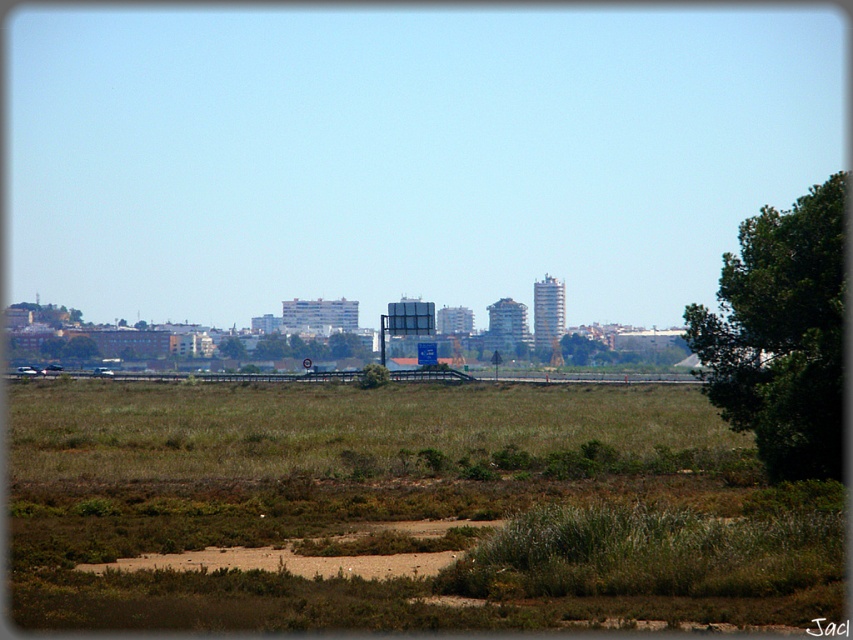
Can you confirm if green leafy tree at right is smaller than green leafy tree at center?

Correct, green leafy tree at right occupies less space than green leafy tree at center.

Which is in front, point (759, 339) or point (285, 348)?

Point (759, 339) is in front.

Who is more distant from viewer, (758, 227) or (239, 355)?

Positioned behind is point (239, 355).

The width and height of the screenshot is (853, 640). Find the location of `green leafy tree at right`. green leafy tree at right is located at coordinates (781, 333).

Between brown dry grass at lower center and green leafy tree at center, which one appears on the right side from the viewer's perspective?

From the viewer's perspective, brown dry grass at lower center appears more on the right side.

Can you confirm if brown dry grass at lower center is positioned to the left of green leafy tree at center?

No, brown dry grass at lower center is not to the left of green leafy tree at center.

Identify the location of brown dry grass at lower center. [403, 509].

Can you confirm if brown dry grass at lower center is positioned to the right of green leafy tree at right?

No, brown dry grass at lower center is not to the right of green leafy tree at right.

In the scene shown: Between brown dry grass at lower center and green leafy tree at right, which one appears on the right side from the viewer's perspective?

green leafy tree at right

Between point (532, 554) and point (776, 225), which one is positioned behind?

Positioned behind is point (776, 225).

What are the coordinates of `brown dry grass at lower center` in the screenshot? It's located at (403, 509).